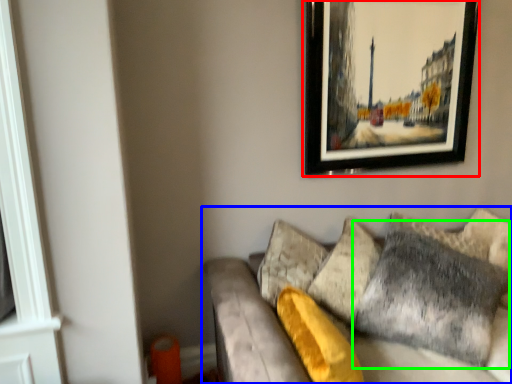
Question: Based on their relative distances, which object is farther from picture frame (highlighted by a red box)? Choose from studio couch (highlighted by a blue box) and pillow (highlighted by a green box).

Choices:
 (A) studio couch
 (B) pillow

Answer: (B)